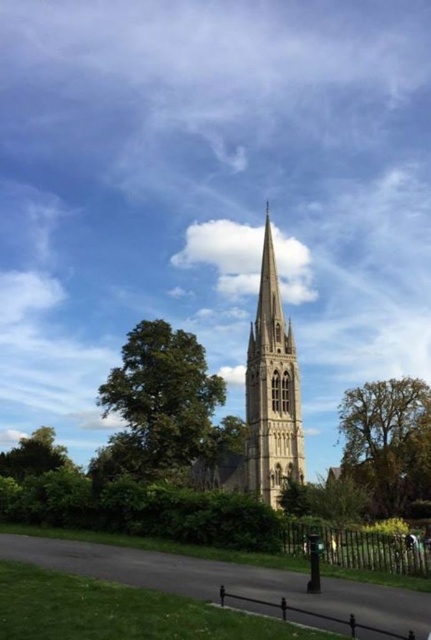
Who is more forward, (268, 474) or (384, 502)?

Point (268, 474) is in front.

Find the location of a particular element. The height and width of the screenshot is (640, 431). beige stone tower at center is located at coordinates (271, 390).

Is green leafy tree at center behind beige stone tower at center?

Yes, it is.

This screenshot has width=431, height=640. I want to click on green leafy tree at center, so click(x=156, y=404).

The height and width of the screenshot is (640, 431). I want to click on green leafy tree at center, so click(x=156, y=404).

Image resolution: width=431 pixels, height=640 pixels. In order to click on green leafy tree at center in this screenshot , I will do `click(156, 404)`.

Is green leafy tree at center behind green leafy tree at right?

No, green leafy tree at center is closer to the viewer.

Can you confirm if green leafy tree at center is bigger than green leafy tree at right?

Correct, green leafy tree at center is larger in size than green leafy tree at right.

Between point (90, 460) and point (399, 378), which one is positioned behind?

The point (399, 378) is more distant.

This screenshot has width=431, height=640. I want to click on green leafy tree at center, so click(156, 404).